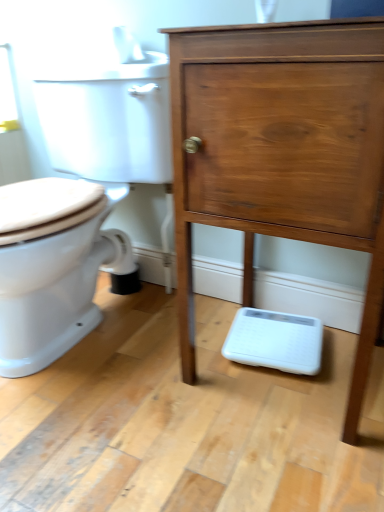
Locate an element on the screen. The width and height of the screenshot is (384, 512). vacant space that's between white glossy toilet at left and matte wood chest of drawers at center is located at coordinates (180, 379).